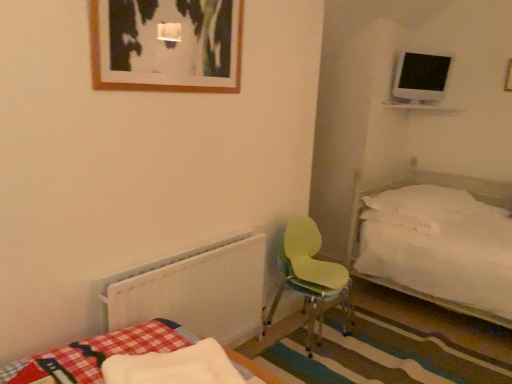
Question: Considering the relative sizes of light green plastic chair at center and white fluffy mattress at lower left in the image provided, is light green plastic chair at center wider than white fluffy mattress at lower left?

Choices:
 (A) yes
 (B) no

Answer: (A)

Question: Is light green plastic chair at center at the left side of white fluffy mattress at lower left?

Choices:
 (A) yes
 (B) no

Answer: (B)

Question: Does light green plastic chair at center have a smaller size compared to white fluffy mattress at lower left?

Choices:
 (A) no
 (B) yes

Answer: (A)

Question: Is light green plastic chair at center positioned in front of white fluffy mattress at lower left?

Choices:
 (A) no
 (B) yes

Answer: (A)

Question: Are light green plastic chair at center and white fluffy mattress at lower left far apart?

Choices:
 (A) yes
 (B) no

Answer: (A)

Question: Is light green plastic chair at center next to white fluffy mattress at lower left?

Choices:
 (A) yes
 (B) no

Answer: (B)

Question: From the image's perspective, would you say wooden picture frame at upper center is shown under white soft pillow at right?

Choices:
 (A) no
 (B) yes

Answer: (A)

Question: Considering the relative positions of wooden picture frame at upper center and white soft pillow at right in the image provided, is wooden picture frame at upper center behind white soft pillow at right?

Choices:
 (A) yes
 (B) no

Answer: (B)

Question: From a real-world perspective, is wooden picture frame at upper center located beneath white soft pillow at right?

Choices:
 (A) no
 (B) yes

Answer: (A)

Question: Does wooden picture frame at upper center turn towards white soft pillow at right?

Choices:
 (A) no
 (B) yes

Answer: (A)

Question: From a real-world perspective, is wooden picture frame at upper center physically above white soft pillow at right?

Choices:
 (A) yes
 (B) no

Answer: (A)

Question: Is wooden picture frame at upper center turned away from white soft pillow at right?

Choices:
 (A) no
 (B) yes

Answer: (A)

Question: Is white soft pillow at right facing away from white fluffy mattress at lower left?

Choices:
 (A) no
 (B) yes

Answer: (A)